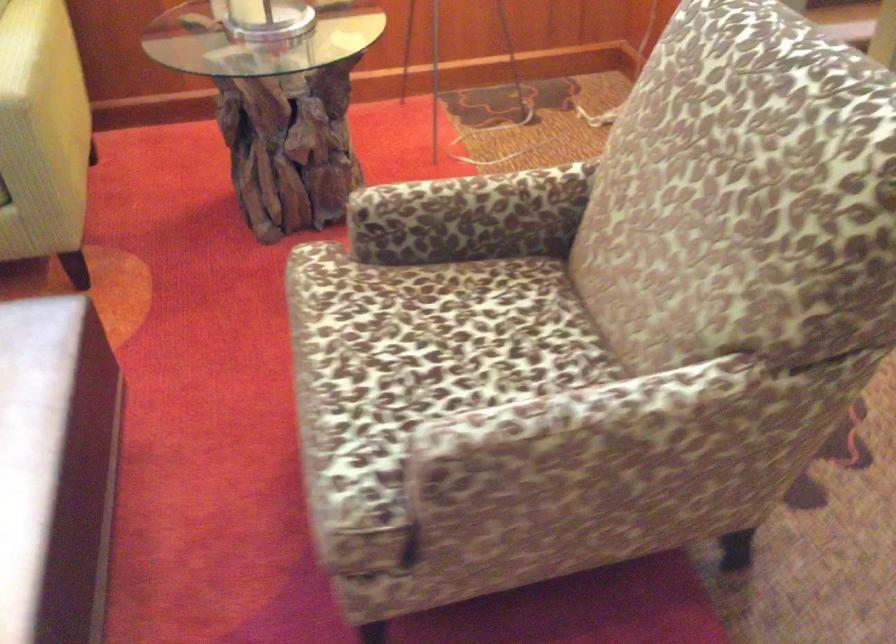
Find the location of a particular element. This screenshot has width=896, height=644. patterned chair sitting surface is located at coordinates (452, 344).